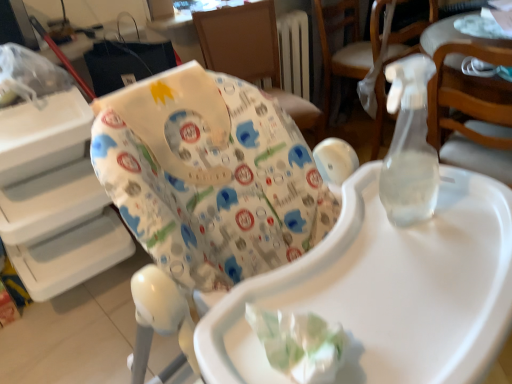
Question: From the image's perspective, relative to white glossy table at upper right, is white fabric highchair at center, which is the first chair in left-to-right order, above or below?

Choices:
 (A) above
 (B) below

Answer: (B)

Question: Considering the positions of white fabric highchair at center, the 2th chair from the right, and white glossy table at upper right in the image, is white fabric highchair at center, the 2th chair from the right, wider or thinner than white glossy table at upper right?

Choices:
 (A) thin
 (B) wide

Answer: (B)

Question: Which object is positioned farthest from the wooden chair at upper right, placed as the second chair when sorted from left to right?

Choices:
 (A) white fabric highchair at center, which is the first chair in left-to-right order
 (B) white glossy table at upper right
 (C) white fabric baby seat at upper center

Answer: (C)

Question: Which is farther from the white glossy table at upper right?

Choices:
 (A) white fabric baby seat at upper center
 (B) wooden chair at upper right, placed as the second chair when sorted from left to right
 (C) white fabric highchair at center, the 2th chair from the right

Answer: (A)